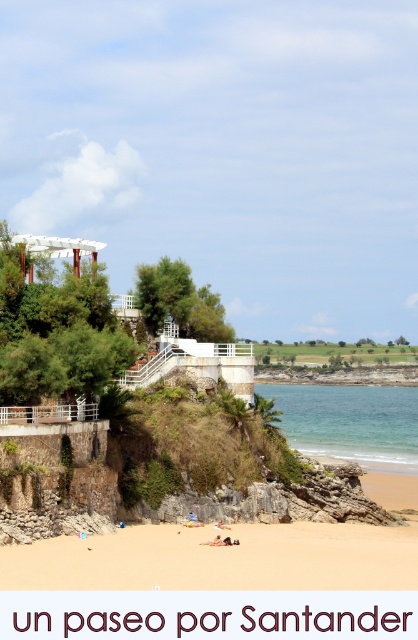
Question: Which object appears closest to the camera in this image?

Choices:
 (A) clear blue water at lower center
 (B) golden sandy beach at lower center

Answer: (B)

Question: Which point is farther to the camera?

Choices:
 (A) (338, 440)
 (B) (259, 532)

Answer: (A)

Question: Is golden sandy beach at lower center wider than clear blue water at lower center?

Choices:
 (A) no
 (B) yes

Answer: (A)

Question: Considering the relative positions of golden sandy beach at lower center and clear blue water at lower center in the image provided, where is golden sandy beach at lower center located with respect to clear blue water at lower center?

Choices:
 (A) above
 (B) below

Answer: (A)

Question: Does golden sandy beach at lower center have a lesser width compared to clear blue water at lower center?

Choices:
 (A) no
 (B) yes

Answer: (B)